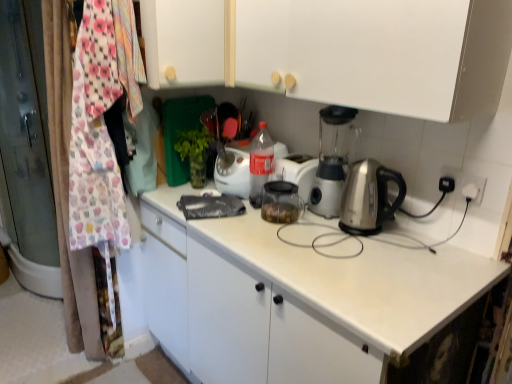
Question: Based on their positions, is white matte cabinet at upper center, placed as the 1th cabinetry when sorted from right to left, located to the left or right of white matte cabinet at upper center, positioned as the 1th cabinetry in left-to-right order?

Choices:
 (A) right
 (B) left

Answer: (A)

Question: Is white matte cabinet at upper center, positioned as the 2th cabinetry in left-to-right order, inside or outside of white matte cabinet at upper center, positioned as the 2th cabinetry in right-to-left order?

Choices:
 (A) inside
 (B) outside

Answer: (B)

Question: Which object is the closest to the white matte cabinet at upper center, positioned as the 2th cabinetry in right-to-left order?

Choices:
 (A) translucent plastic bottle at center
 (B) white matte cabinet at upper center, placed as the 1th cabinetry when sorted from right to left

Answer: (B)

Question: Which of these objects is positioned closest to the white matte cabinet at upper center, placed as the 1th cabinetry when sorted from right to left?

Choices:
 (A) translucent plastic bottle at center
 (B) white matte cabinet at upper center, positioned as the 2th cabinetry in right-to-left order

Answer: (B)